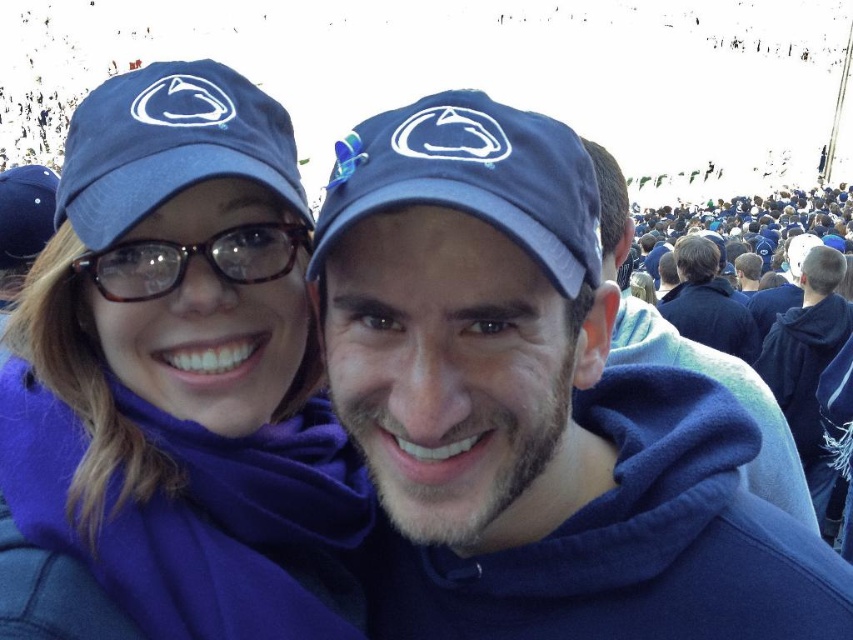
You are a photographer at the event and need to capture a photo that includes both the matte blue cap at center and the matte blue cap at upper left. Given that your camera has a maximum focus range of 12 meters, will you be able to include both caps in the same frame?

The distance between the matte blue cap at center and the matte blue cap at upper left is 13.23 meters, which exceeds the camera maximum focus range of 12 meters. Therefore, you cannot include both caps in the same frame.

You are a photographer at the event and need to adjust your camera focus. Which object, the matte blue cap at center or the blue fleece jacket at right, is closer to the camera based on their positions?

The matte blue cap at center is located below the blue fleece jacket at right, meaning it is closer to the camera since it appears lower in the frame.

Looking at this image, you are standing at the point marked as point (196, 221) in the image. You want to walk to the nearest exit, which is located behind the crowd of people in the background. Considering the distance between you and the exit, do you think you can reach it without needing to navigate through the crowd?

The distance between point (196, 221) and the viewer is 206.74 feet. Since the exit is behind the crowd in the background, you would need to walk through the crowd to reach it, as the distance is significant and there is no mention of alternative pathways.